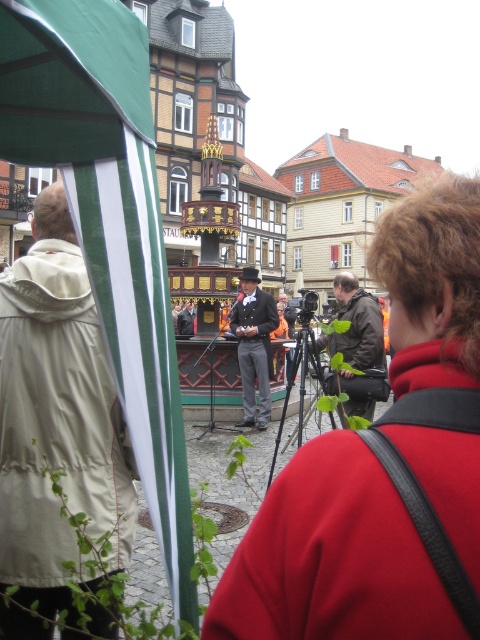
Question: Which of the following is the closest to the observer?

Choices:
 (A) (191, 330)
 (B) (8, 298)
 (C) (436, 605)

Answer: (C)

Question: Considering the relative positions of shiny black suit at center and smooth black suit at center in the image provided, where is shiny black suit at center located with respect to smooth black suit at center?

Choices:
 (A) below
 (B) above

Answer: (A)

Question: Among these points, which one is nearest to the camera?

Choices:
 (A) (79, 227)
 (B) (242, 358)

Answer: (A)

Question: Which point is closer to the camera?

Choices:
 (A) (364, 358)
 (B) (44, 285)
 (C) (193, 308)

Answer: (B)

Question: Can you confirm if matte black coat at center is wider than shiny black suit at center?

Choices:
 (A) yes
 (B) no

Answer: (A)

Question: From the image, what is the correct spatial relationship of green fabric canopy at left in relation to smooth black suit at center?

Choices:
 (A) below
 (B) above

Answer: (A)